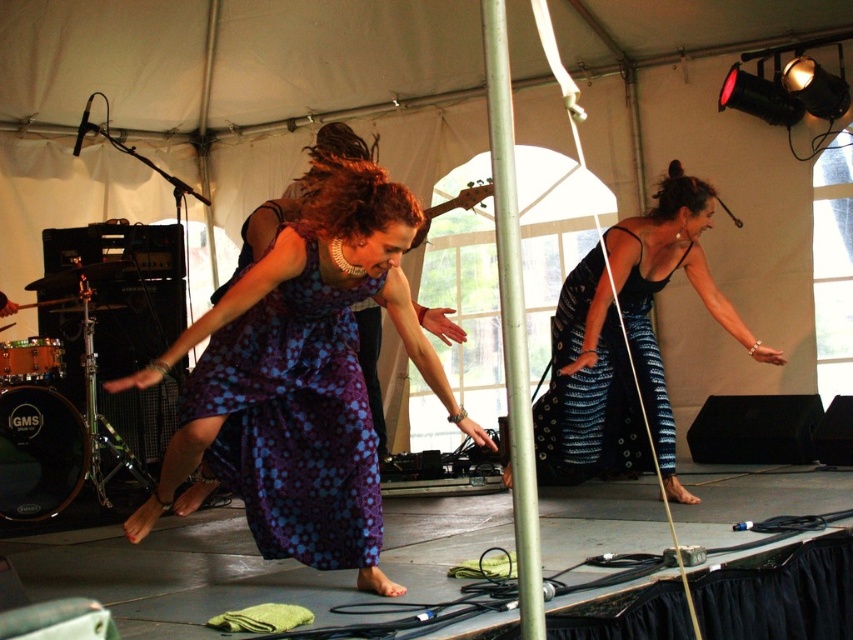
Question: Which object is positioned farthest from the purple dotted fabric dress at center?

Choices:
 (A) purple dotted dress at center
 (B) metallic silver bracelet at upper center

Answer: (B)

Question: Can you confirm if purple dotted fabric dress at center is positioned below metallic silver bracelet at upper center?

Choices:
 (A) no
 (B) yes

Answer: (B)

Question: Can you confirm if purple dotted fabric dress at center is smaller than metallic silver bracelet at upper center?

Choices:
 (A) yes
 (B) no

Answer: (B)

Question: Where is purple dotted dress at center located in relation to metallic silver bracelet at upper center in the image?

Choices:
 (A) above
 (B) below

Answer: (B)

Question: Which object appears farthest from the camera in this image?

Choices:
 (A) purple dotted fabric dress at center
 (B) metallic silver bracelet at upper center

Answer: (B)

Question: Which object is the closest to the purple dotted dress at center?

Choices:
 (A) metallic silver bracelet at upper center
 (B) black textured dress at right
 (C) blue dotted dress at center
 (D) purple dotted fabric dress at center

Answer: (D)